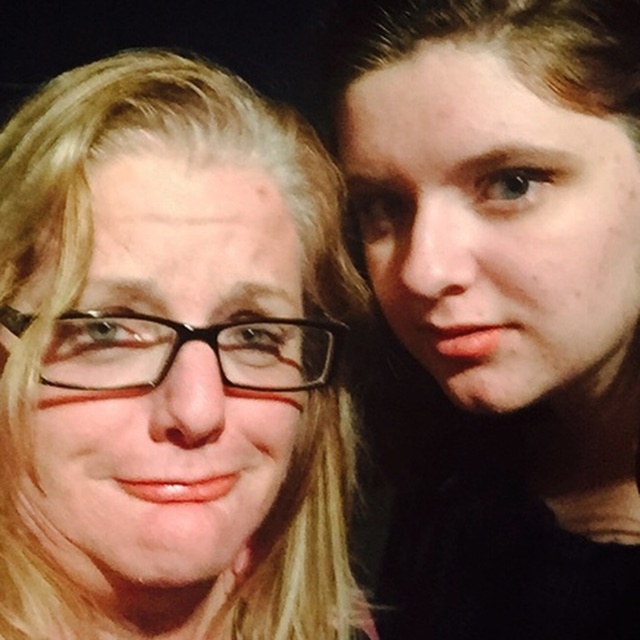
Question: Among these points, which one is nearest to the camera?

Choices:
 (A) (397, 20)
 (B) (227, 333)

Answer: (B)

Question: Observing the image, what is the correct spatial positioning of smooth skin face at right in reference to black plastic glasses at left?

Choices:
 (A) above
 (B) below

Answer: (B)

Question: Does smooth skin face at right appear under black plastic glasses at left?

Choices:
 (A) no
 (B) yes

Answer: (B)

Question: Which object is farther from the camera taking this photo?

Choices:
 (A) smooth skin face at right
 (B) black plastic glasses at left

Answer: (A)

Question: Can you confirm if smooth skin face at right is thinner than black plastic glasses at left?

Choices:
 (A) no
 (B) yes

Answer: (A)